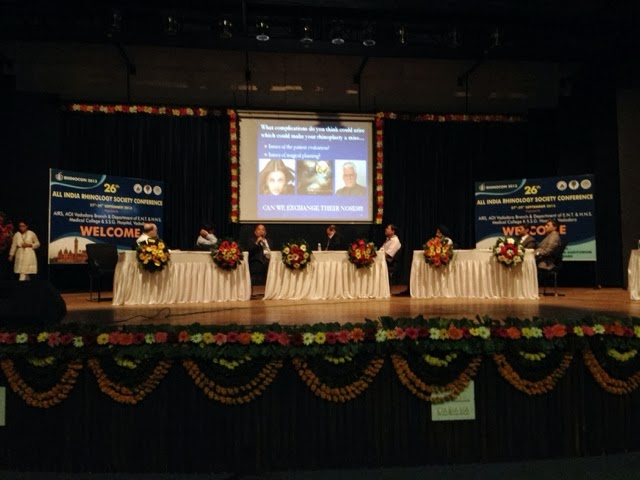
I want to click on projection screen, so click(x=246, y=187).